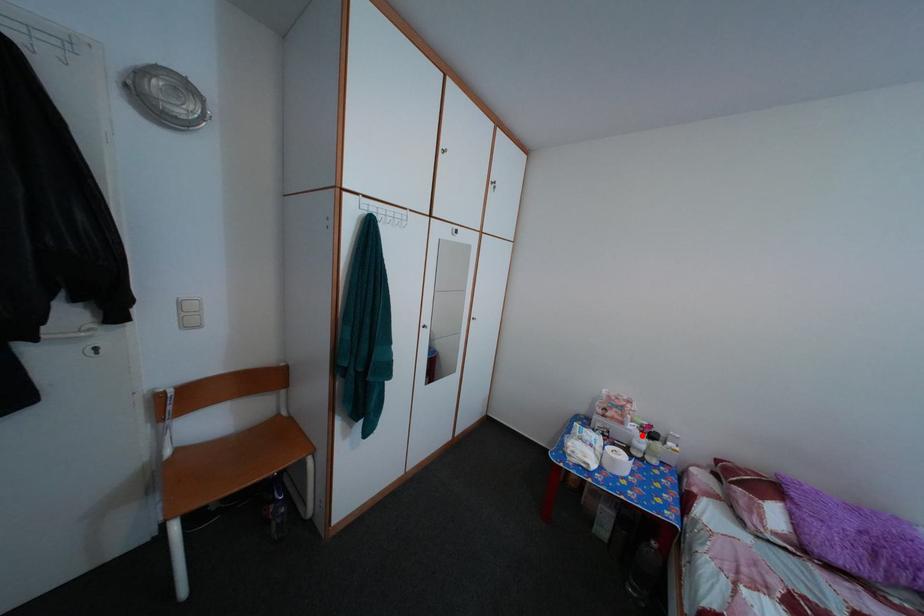
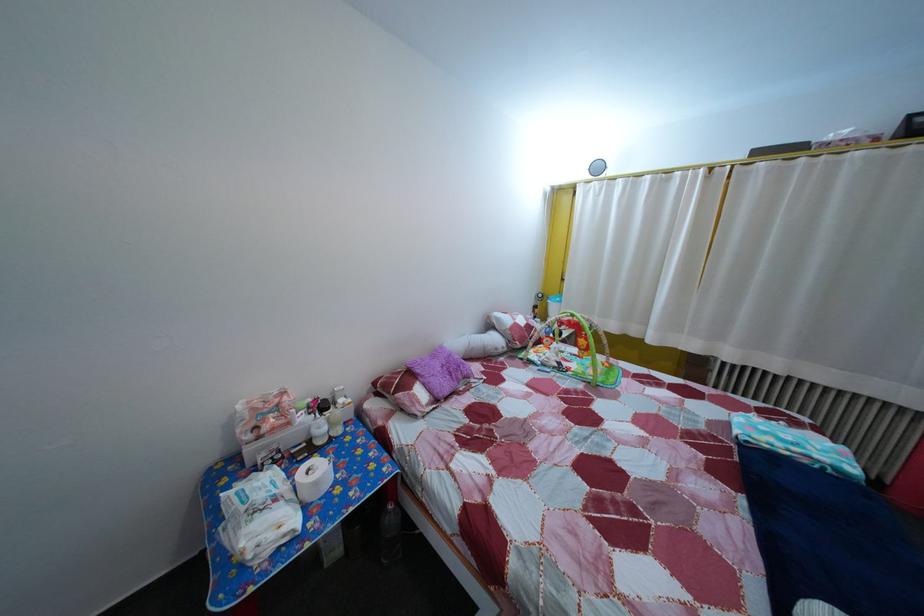
Question: I am providing you with two images of the same scene from different viewpoints. In image1, a red point is highlighted. Considering the same 3D point in image2, which of the following is correct?

Choices:
 (A) It is closer
 (B) It is farther

Answer: (A)